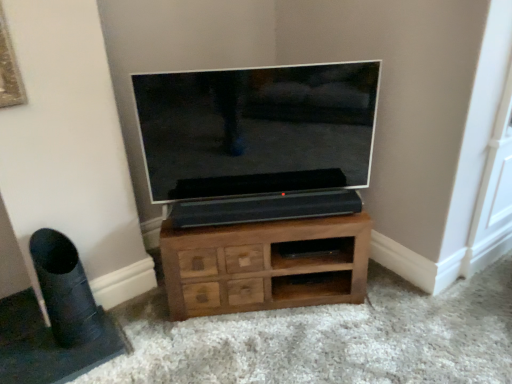
Question: Is brown wood chest of drawers at center positioned far away from black matte speaker at lower left?

Choices:
 (A) yes
 (B) no

Answer: (B)

Question: Considering the relative sizes of brown wood chest of drawers at center and black matte speaker at lower left in the image provided, is brown wood chest of drawers at center smaller than black matte speaker at lower left?

Choices:
 (A) no
 (B) yes

Answer: (A)

Question: Can you confirm if brown wood chest of drawers at center is taller than black matte speaker at lower left?

Choices:
 (A) no
 (B) yes

Answer: (A)

Question: From the image's perspective, is brown wood chest of drawers at center located beneath black matte speaker at lower left?

Choices:
 (A) yes
 (B) no

Answer: (B)

Question: Does brown wood chest of drawers at center have a greater width compared to black matte speaker at lower left?

Choices:
 (A) no
 (B) yes

Answer: (B)

Question: Is flat screen tv at center in front of or behind brown wood chest of drawers at center in the image?

Choices:
 (A) front
 (B) behind

Answer: (A)

Question: From a real-world perspective, is flat screen tv at center above or below brown wood chest of drawers at center?

Choices:
 (A) above
 (B) below

Answer: (A)

Question: From the image's perspective, is flat screen tv at center positioned above or below brown wood chest of drawers at center?

Choices:
 (A) below
 (B) above

Answer: (B)

Question: Considering the positions of flat screen tv at center and brown wood chest of drawers at center in the image, is flat screen tv at center bigger or smaller than brown wood chest of drawers at center?

Choices:
 (A) small
 (B) big

Answer: (A)

Question: Which is correct: flat screen tv at center is inside black matte speaker at lower left, or outside of it?

Choices:
 (A) outside
 (B) inside

Answer: (A)

Question: In terms of size, does flat screen tv at center appear bigger or smaller than black matte speaker at lower left?

Choices:
 (A) small
 (B) big

Answer: (B)

Question: Is point (306, 64) closer or farther from the camera than point (64, 271)?

Choices:
 (A) farther
 (B) closer

Answer: (A)

Question: Is flat screen tv at center wider or thinner than black matte speaker at lower left?

Choices:
 (A) wide
 (B) thin

Answer: (B)

Question: From the image's perspective, is brown wood chest of drawers at center positioned above or below flat screen tv at center?

Choices:
 (A) above
 (B) below

Answer: (B)

Question: Based on their sizes in the image, would you say brown wood chest of drawers at center is bigger or smaller than flat screen tv at center?

Choices:
 (A) small
 (B) big

Answer: (B)